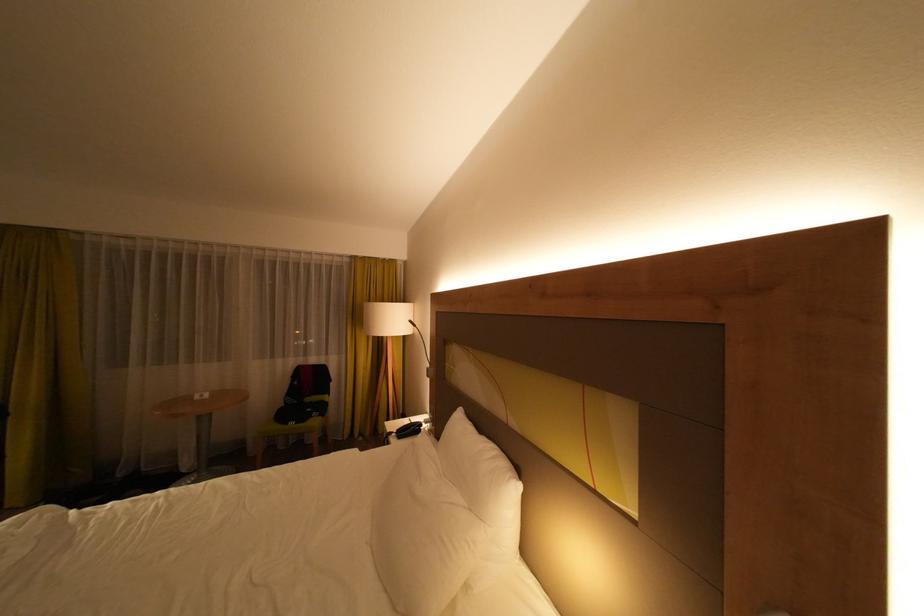
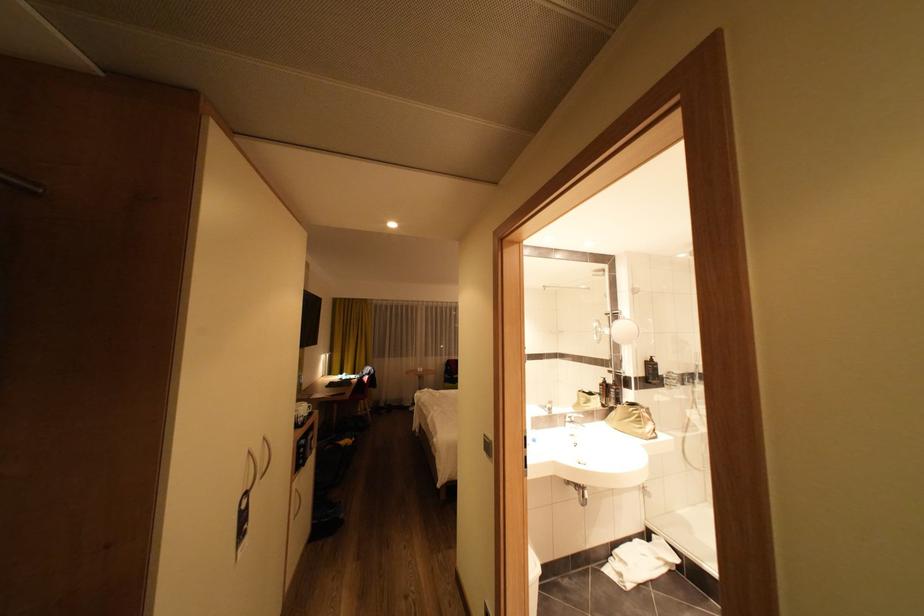
Question: Which direction would the cameraman need to move to produce the second image? Reply with the corresponding letter.

Choices:
 (A) Left
 (B) Right
 (C) Forward
 (D) Backward

Answer: (D)